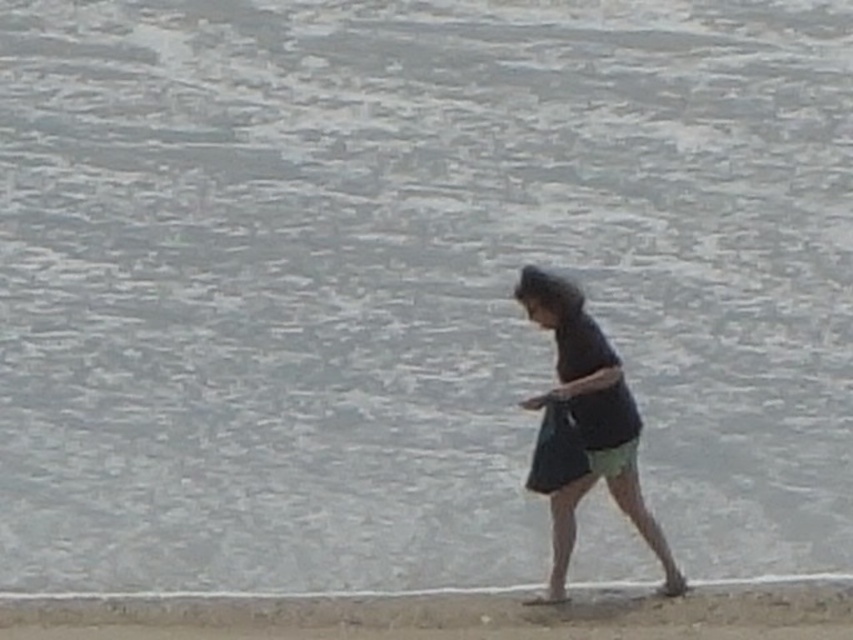
You are a drone operator trying to capture a photo of the shoreline. The sandy beach at lower center is your main subject. To ensure the sandy beach at lower center is centered in the photo, where should you position the drone relative to the point marked at coordinates point (451, 614)?

The point marked at coordinates point (451, 614) already marks the sandy beach at lower center, so positioning the drone directly above this point would center the sandy beach at lower center in the photo.

You are a photographer trying to capture the shoreline scene. You notice two points of interest marked as point 1 at coordinates point (x=843, y=620) and point 2 at coordinates point (x=621, y=371). Which point is closer to your camera position?

Point (x=843, y=620) is closer to the viewer than point (x=621, y=371), so the photographer should focus on that point for a closer shot.